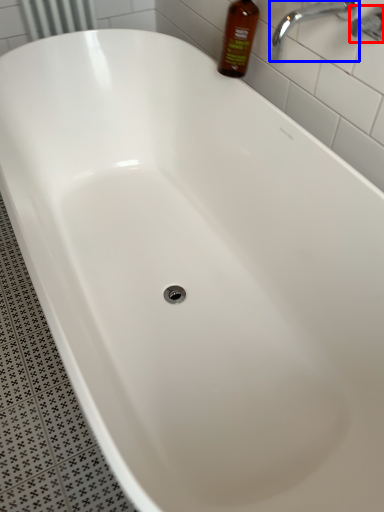
Question: Among these objects, which one is farthest to the camera, plumbing fixture (highlighted by a red box) or tap (highlighted by a blue box)?

Choices:
 (A) plumbing fixture
 (B) tap

Answer: (B)